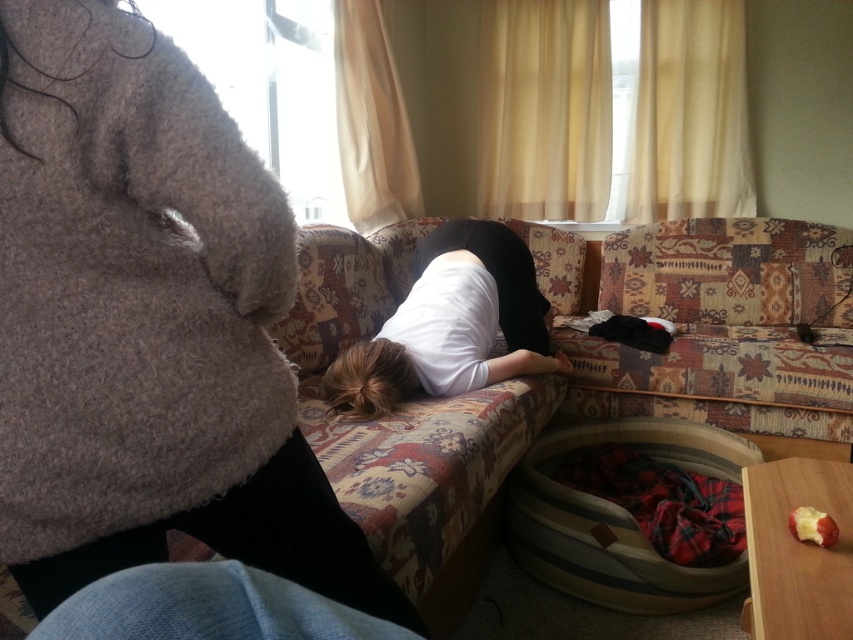
Question: Is fuzzy beige sweater at upper left positioned behind white matte shirt at center?

Choices:
 (A) yes
 (B) no

Answer: (B)

Question: Among these points, which one is farthest from the camera?

Choices:
 (A) (543, 356)
 (B) (715, 435)

Answer: (B)

Question: Which point is closer to the camera taking this photo?

Choices:
 (A) (99, 337)
 (B) (372, 339)

Answer: (A)

Question: Which point is closer to the camera?

Choices:
 (A) fuzzy beige sweater at upper left
 (B) white matte shirt at center
 (C) wooden pet bed at lower right

Answer: (A)

Question: Does fuzzy beige sweater at upper left appear on the right side of wooden pet bed at lower right?

Choices:
 (A) yes
 (B) no

Answer: (B)

Question: Is wooden pet bed at lower right smaller than white matte shirt at center?

Choices:
 (A) no
 (B) yes

Answer: (B)